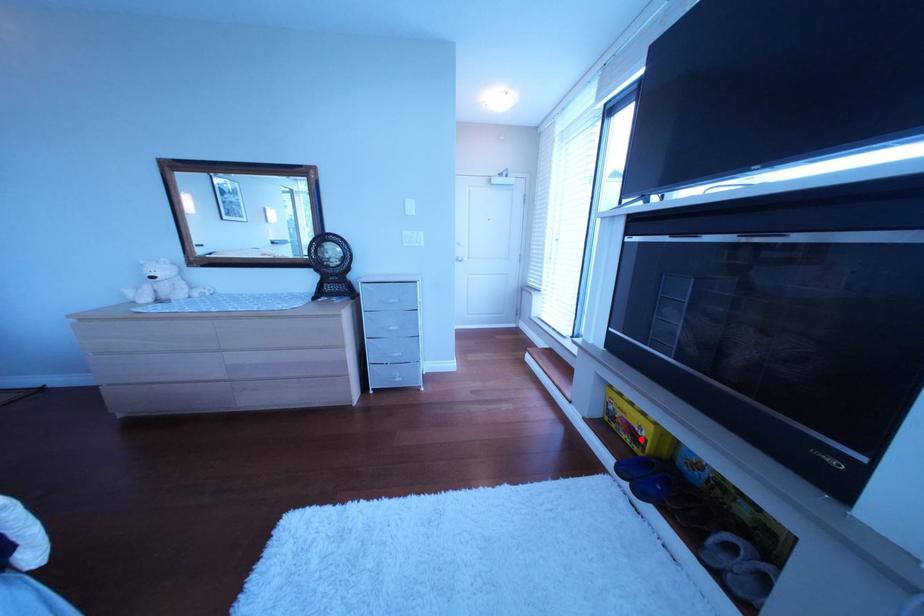
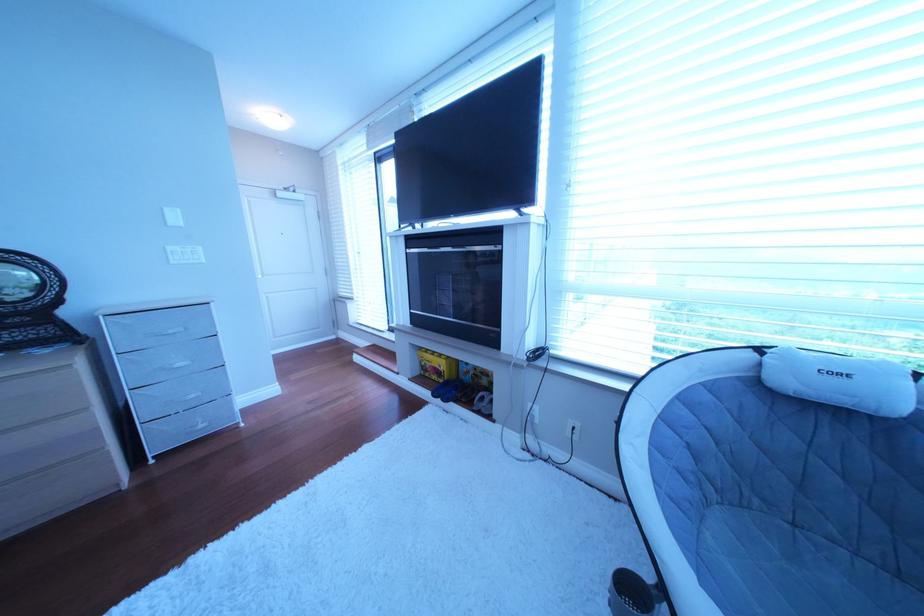
Question: I am providing you with two images of the same scene from different viewpoints. A red point is shown in image1. For the corresponding object point in image2, is it positioned nearer or farther from the camera?

Choices:
 (A) Nearer
 (B) Farther

Answer: (B)